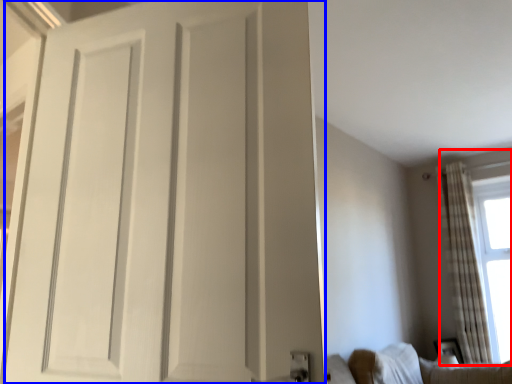
Question: Which of the following is the closest to the observer, window (highlighted by a red box) or door (highlighted by a blue box)?

Choices:
 (A) window
 (B) door

Answer: (B)